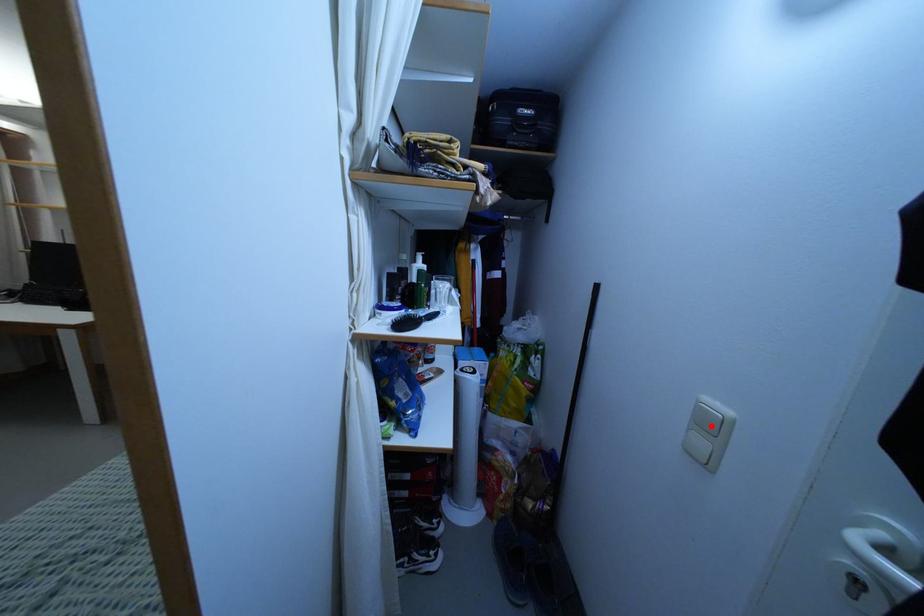
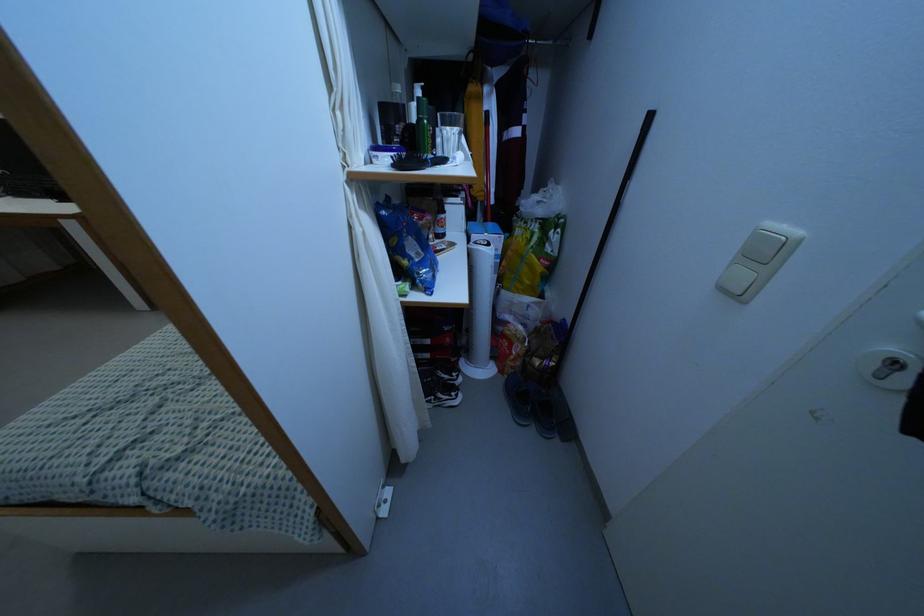
In the second image, find the point that corresponds to the highlighted location in the first image.

(762, 254)